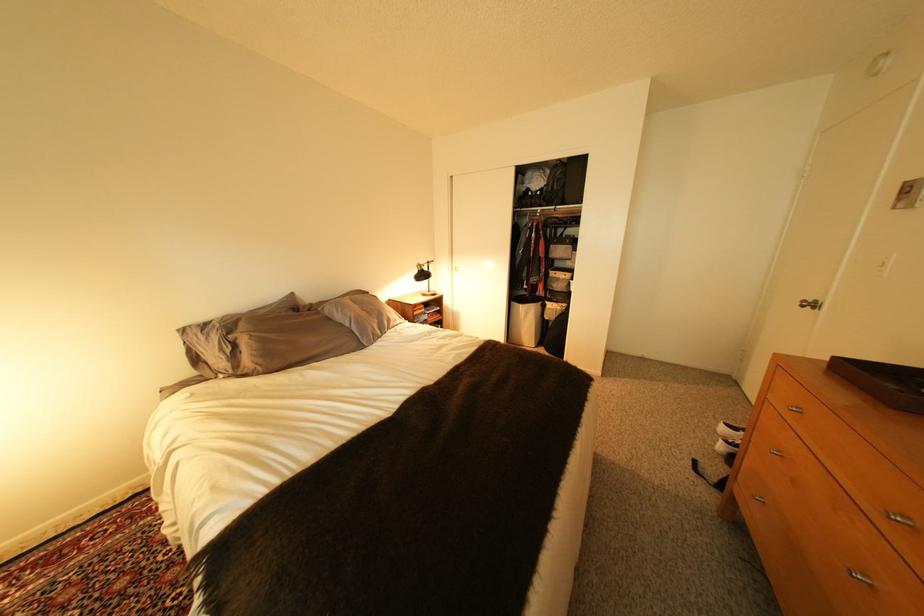
Where is `gray laundry hamper`? This screenshot has width=924, height=616. gray laundry hamper is located at coordinates (525, 321).